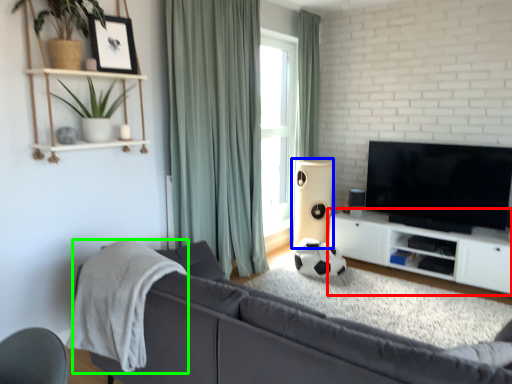
Question: Estimate the real-world distances between objects in this image. Which object is farther from cabinetry (highlighted by a red box), speaker (highlighted by a blue box) or blanket (highlighted by a green box)?

Choices:
 (A) speaker
 (B) blanket

Answer: (B)